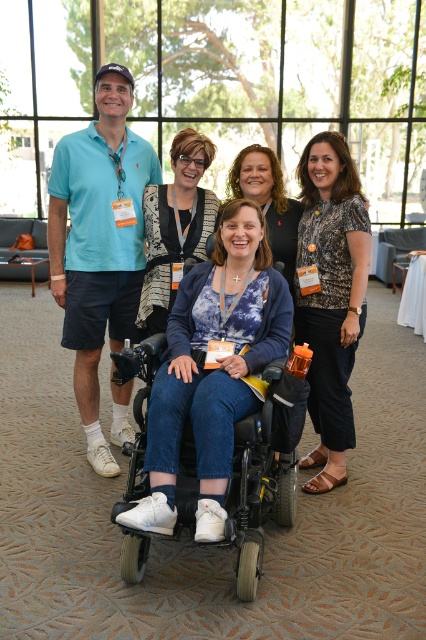
Describe the element at coordinates (213, 369) in the screenshot. I see `white matte wheelchair at center` at that location.

Between white matte wheelchair at center and printed fabric blouse at center, which one has more height?

printed fabric blouse at center

Between point (250, 307) and point (356, 273), which one is positioned behind?

The point (356, 273) is behind.

This screenshot has width=426, height=640. Find the location of `white matte wheelchair at center`. white matte wheelchair at center is located at coordinates (213, 369).

Can you confirm if white matte wheelchair at center is taller than black matte wheelchair at center?

Yes.

Between white matte wheelchair at center and black matte wheelchair at center, which one has less height?

Standing shorter between the two is black matte wheelchair at center.

Between point (236, 324) and point (118, 509), which one is positioned in front?

Positioned in front is point (118, 509).

At what (x,y) coordinates should I click in order to perform the action: click on white matte wheelchair at center. Please return your answer as a coordinate pair (x, y). This screenshot has width=426, height=640. Looking at the image, I should click on (213, 369).

Between matte black top at center and matte black wheelchair at center, which one is positioned lower?

matte black top at center

Who is shorter, matte black top at center or matte black wheelchair at center?

With less height is matte black wheelchair at center.

Which is in front, point (199, 221) or point (250, 172)?

Positioned in front is point (199, 221).

In order to click on matte black top at center in this screenshot , I will do `click(175, 227)`.